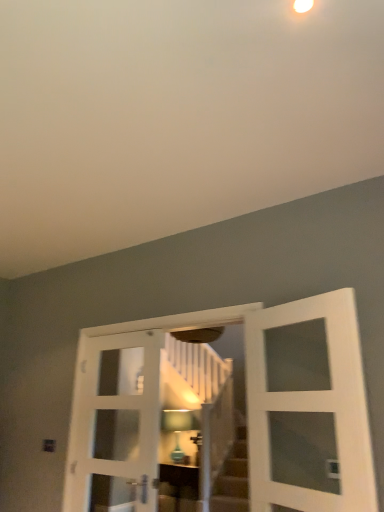
Question: Can you confirm if matte glass lampshade at center is bigger than matte brown cabinet at center?

Choices:
 (A) yes
 (B) no

Answer: (B)

Question: Considering the relative positions of matte glass lampshade at center and matte brown cabinet at center in the image provided, is matte glass lampshade at center to the left of matte brown cabinet at center from the viewer's perspective?

Choices:
 (A) no
 (B) yes

Answer: (B)

Question: Does matte glass lampshade at center appear on the right side of matte brown cabinet at center?

Choices:
 (A) yes
 (B) no

Answer: (B)

Question: Is matte glass lampshade at center closer to camera compared to matte brown cabinet at center?

Choices:
 (A) no
 (B) yes

Answer: (A)

Question: Does matte glass lampshade at center contain matte brown cabinet at center?

Choices:
 (A) no
 (B) yes

Answer: (A)

Question: Can you confirm if matte glass lampshade at center is shorter than matte brown cabinet at center?

Choices:
 (A) yes
 (B) no

Answer: (B)

Question: Is matte glass lampshade at center surrounded by white glass door at center, marked as the 3th door in a right-to-left arrangement?

Choices:
 (A) no
 (B) yes

Answer: (A)

Question: Does white glass door at center, marked as the 3th door in a right-to-left arrangement, lie behind matte glass lampshade at center?

Choices:
 (A) yes
 (B) no

Answer: (B)

Question: Considering the relative sizes of white glass door at center, which appears as the 1th door when viewed from the left, and matte glass lampshade at center in the image provided, is white glass door at center, which appears as the 1th door when viewed from the left, smaller than matte glass lampshade at center?

Choices:
 (A) yes
 (B) no

Answer: (B)

Question: Does white glass door at center, marked as the 3th door in a right-to-left arrangement, appear on the right side of matte glass lampshade at center?

Choices:
 (A) yes
 (B) no

Answer: (B)

Question: From the image's perspective, would you say white glass door at center, which appears as the 1th door when viewed from the left, is shown under matte glass lampshade at center?

Choices:
 (A) no
 (B) yes

Answer: (A)

Question: Considering the relative sizes of white glass door at center, which appears as the 1th door when viewed from the left, and matte glass lampshade at center in the image provided, is white glass door at center, which appears as the 1th door when viewed from the left, thinner than matte glass lampshade at center?

Choices:
 (A) no
 (B) yes

Answer: (B)

Question: Can you confirm if matte glass lampshade at center is shorter than white wooden door at center, which is counted as the second door, starting from the right?

Choices:
 (A) no
 (B) yes

Answer: (B)